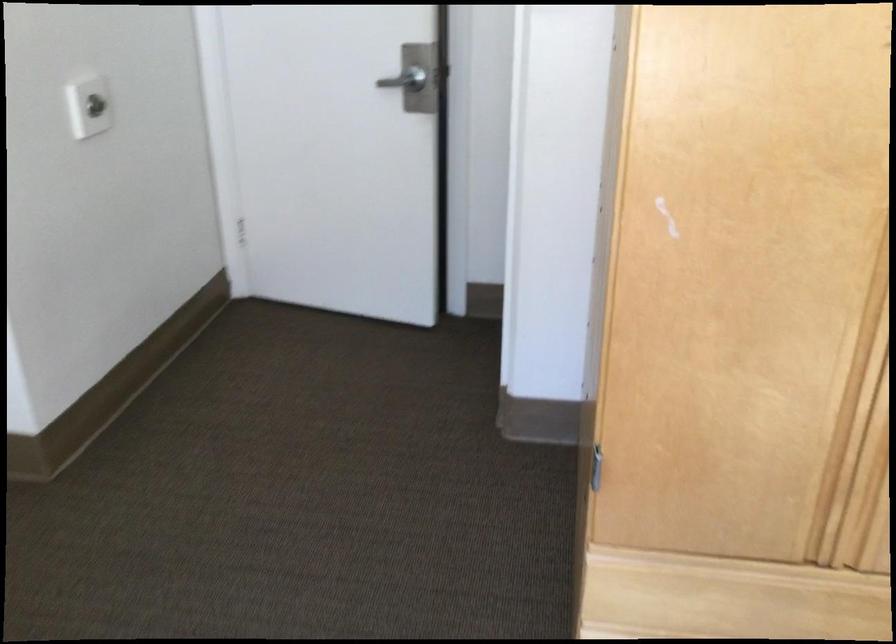
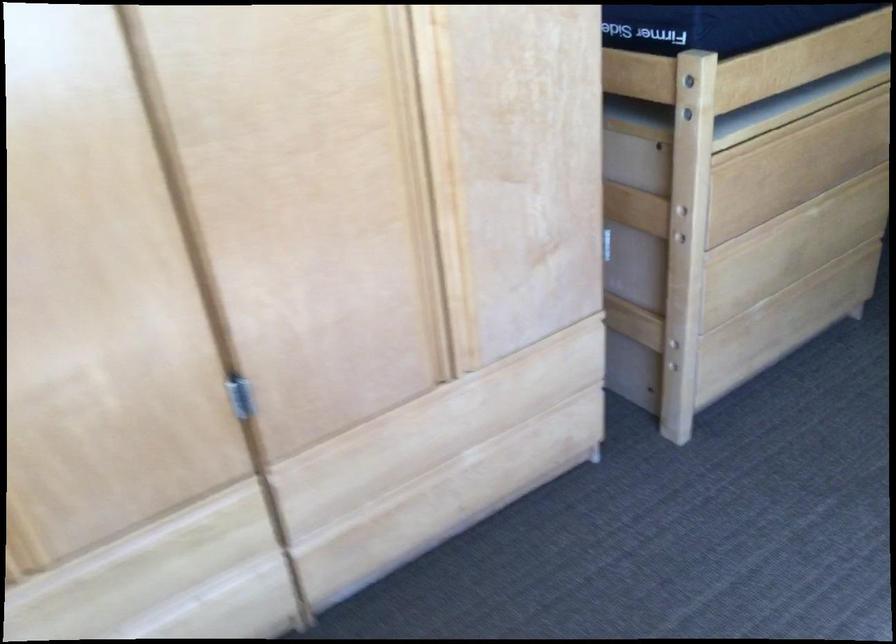
Question: The camera is either moving clockwise (left) or counter-clockwise (right) around the object. The first image is from the beginning of the video and the second image is from the end. Is the camera moving left or right when shooting the video?

Choices:
 (A) Left
 (B) Right

Answer: (A)